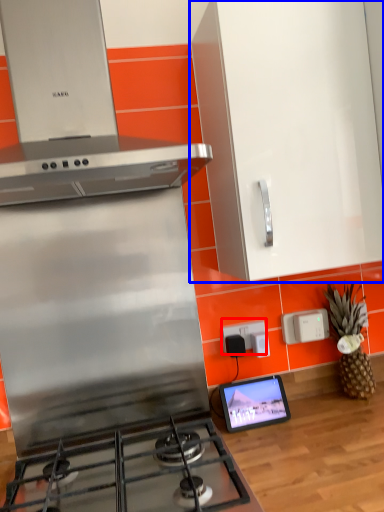
Question: Among these objects, which one is nearest to the camera, electric outlet (highlighted by a red box) or cabinetry (highlighted by a blue box)?

Choices:
 (A) electric outlet
 (B) cabinetry

Answer: (B)